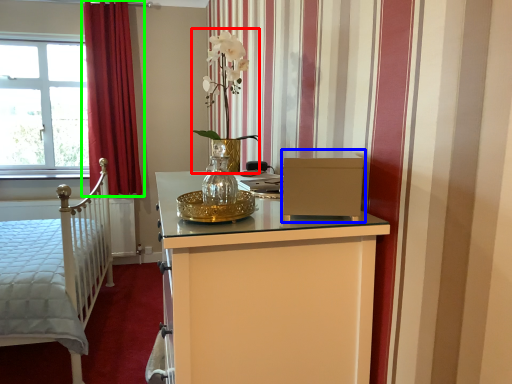
Question: Considering the real-world distances, which object is closest to floral arrangement (highlighted by a red box)? file cabinet (highlighted by a blue box) or curtain (highlighted by a green box).

Choices:
 (A) file cabinet
 (B) curtain

Answer: (A)